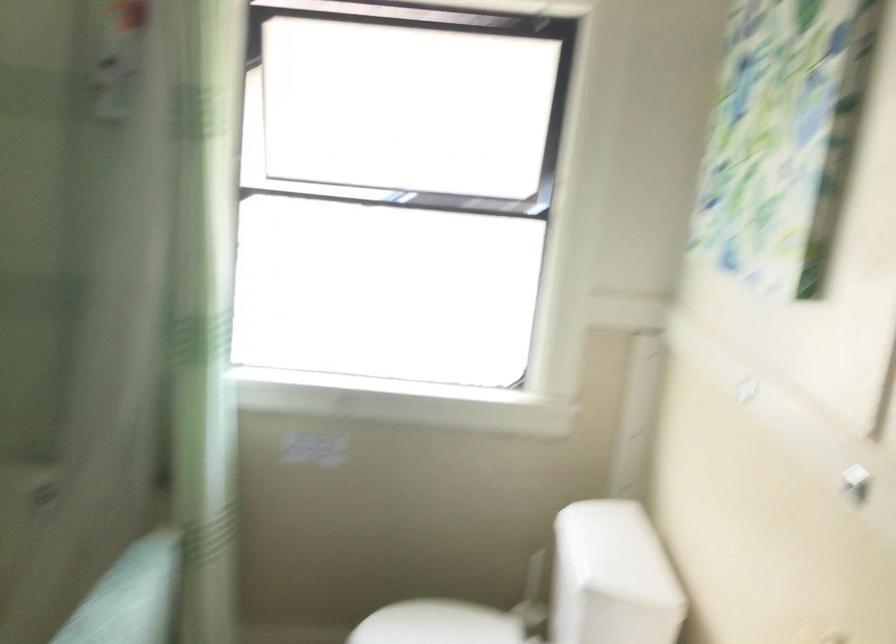
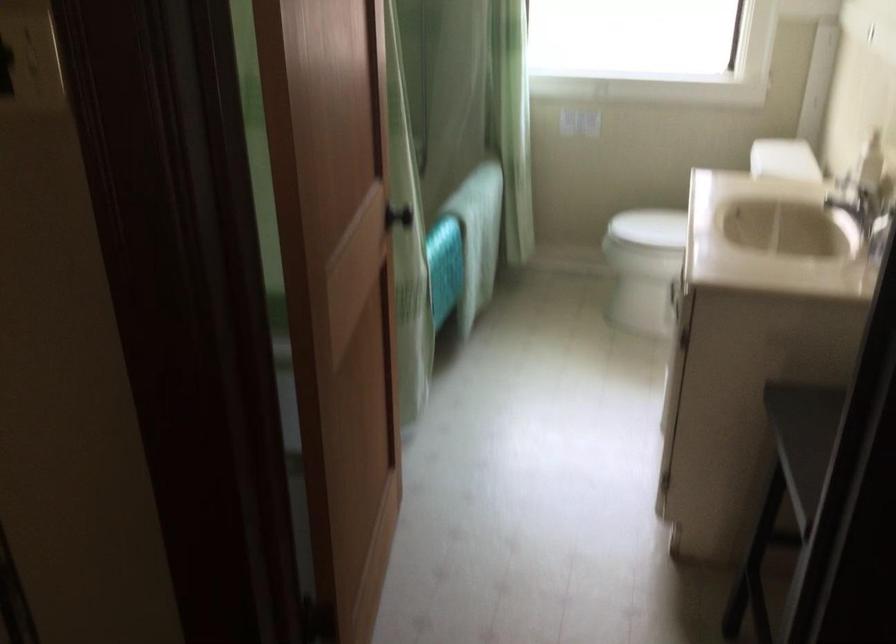
The point at (622,572) is marked in the first image. Where is the corresponding point in the second image?

(784, 158)